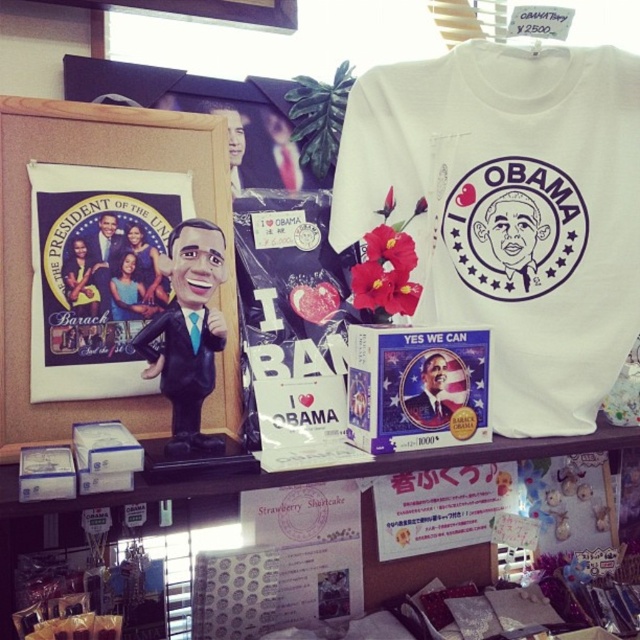
Question: Among these objects, which one is nearest to the camera?

Choices:
 (A) wooden frame at left
 (B) white paper at upper center
 (C) white cotton t-shirt at upper right

Answer: (B)

Question: Which of the following is the closest to the observer?

Choices:
 (A) (371, 499)
 (B) (584, 321)
 (C) (35, 420)

Answer: (C)

Question: Does white cotton t-shirt at upper right appear under white paper at upper center?

Choices:
 (A) no
 (B) yes

Answer: (A)

Question: Is wooden frame at left positioned at the back of white paper at upper center?

Choices:
 (A) yes
 (B) no

Answer: (A)

Question: Is white cotton t-shirt at upper right further to the viewer compared to white paper at upper center?

Choices:
 (A) yes
 (B) no

Answer: (A)

Question: Which point is closer to the camera?

Choices:
 (A) (433, 232)
 (B) (305, 476)

Answer: (B)